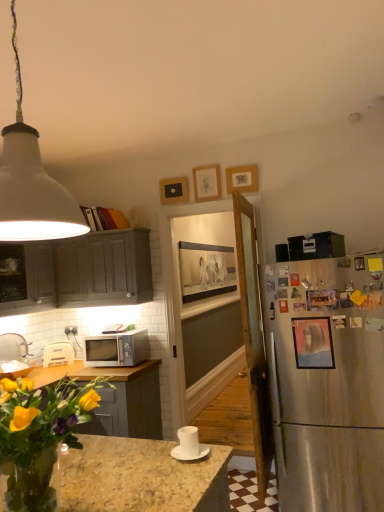
This screenshot has width=384, height=512. What do you see at coordinates (58, 354) in the screenshot?
I see `white plastic toaster at lower left` at bounding box center [58, 354].

This screenshot has width=384, height=512. What do you see at coordinates (322, 300) in the screenshot?
I see `wooden picture frame at right, acting as the 6th picture frame starting from the back` at bounding box center [322, 300].

The width and height of the screenshot is (384, 512). What do you see at coordinates (174, 190) in the screenshot?
I see `wooden picture frame at upper center, the 5th picture frame viewed from the front` at bounding box center [174, 190].

Image resolution: width=384 pixels, height=512 pixels. Find the location of `translucent glass vase at lower left`. translucent glass vase at lower left is located at coordinates (39, 436).

Consider the image. Between wooden picture frame at right, acting as the 6th picture frame starting from the back, and matte wooden picture frame at center, which is the sixth picture frame in front-to-back order, which one has smaller size?

With smaller size is wooden picture frame at right, acting as the 6th picture frame starting from the back.

Is wooden picture frame at right, marked as the first picture frame in a front-to-back arrangement, touching matte wooden picture frame at center, which is the sixth picture frame in front-to-back order?

No.

Can you confirm if wooden picture frame at right, acting as the 6th picture frame starting from the back, is taller than matte wooden picture frame at center, the first picture frame in the back-to-front sequence?

Incorrect, the height of wooden picture frame at right, acting as the 6th picture frame starting from the back, is not larger of that of matte wooden picture frame at center, the first picture frame in the back-to-front sequence.

From a real-world perspective, is wooden picture frame at right, acting as the 6th picture frame starting from the back, positioned above or below matte wooden picture frame at center, the first picture frame in the back-to-front sequence?

Clearly, from a real-world perspective, wooden picture frame at right, acting as the 6th picture frame starting from the back, is below matte wooden picture frame at center, the first picture frame in the back-to-front sequence.

Are wooden picture frame at upper center, the 2th picture frame positioned from the back, and white plastic toaster at lower left beside each other?

wooden picture frame at upper center, the 2th picture frame positioned from the back, is not next to white plastic toaster at lower left, and they're not touching.

Is wooden picture frame at upper center, the 5th picture frame viewed from the front, positioned behind white plastic toaster at lower left?

No, it is in front of white plastic toaster at lower left.

What's the angular difference between wooden picture frame at upper center, the 5th picture frame viewed from the front, and white plastic toaster at lower left's facing directions?

They differ by 33.4 degrees in their facing directions.

Considering the sizes of objects wooden picture frame at upper center, the 2th picture frame positioned from the back, and white plastic toaster at lower left in the image provided, who is taller, wooden picture frame at upper center, the 2th picture frame positioned from the back, or white plastic toaster at lower left?

With more height is wooden picture frame at upper center, the 2th picture frame positioned from the back.

Considering the positions of objects matte wooden picture frame at upper center, which ranks as the 4th picture frame in front-to-back order, and matte pink picture frame at right, arranged as the fifth picture frame when viewed from the back, in the image provided, who is in front, matte wooden picture frame at upper center, which ranks as the 4th picture frame in front-to-back order, or matte pink picture frame at right, arranged as the fifth picture frame when viewed from the back,?

matte pink picture frame at right, arranged as the fifth picture frame when viewed from the back, is more forward.

Considering the sizes of objects matte wooden picture frame at upper center, which ranks as the 4th picture frame in front-to-back order, and matte pink picture frame at right, arranged as the fifth picture frame when viewed from the back, in the image provided, who is smaller, matte wooden picture frame at upper center, which ranks as the 4th picture frame in front-to-back order, or matte pink picture frame at right, arranged as the fifth picture frame when viewed from the back,?

Smaller between the two is matte pink picture frame at right, arranged as the fifth picture frame when viewed from the back.

The height and width of the screenshot is (512, 384). There is a matte wooden picture frame at upper center, the 3th picture frame in the back-to-front sequence. What are the coordinates of `the 5th picture frame below it (from a real-world perspective)` in the screenshot? It's located at (313, 343).

Locate an element on the screen. This screenshot has width=384, height=512. the 1st picture frame counting from the right of the wooden picture frame at upper center, which is counted as the 3th picture frame, starting from the front is located at coordinates (313, 343).

Between matte pink picture frame at right, arranged as the fifth picture frame when viewed from the back, and wooden picture frame at upper center, arranged as the 4th picture frame when viewed from the back, which one is positioned in front?

Positioned in front is matte pink picture frame at right, arranged as the fifth picture frame when viewed from the back.

Is wooden picture frame at upper center, arranged as the 4th picture frame when viewed from the back, located within matte pink picture frame at right, arranged as the fifth picture frame when viewed from the back?

Definitely not — wooden picture frame at upper center, arranged as the 4th picture frame when viewed from the back, is not inside matte pink picture frame at right, arranged as the fifth picture frame when viewed from the back.

Which object is positioned more to the right, white matte pendant light at upper left or translucent glass vase at lower left?

translucent glass vase at lower left.

Is white matte pendant light at upper left positioned with its back to translucent glass vase at lower left?

white matte pendant light at upper left does not have its back to translucent glass vase at lower left.

Based on the photo, from a real-world perspective, which is physically above, white matte pendant light at upper left or translucent glass vase at lower left?

white matte pendant light at upper left is physically above.

From the image's perspective, is white matte pendant light at upper left below translucent glass vase at lower left?

No, from the image's perspective, white matte pendant light at upper left is not below translucent glass vase at lower left.

Does point (253, 189) come behind point (214, 173)?

No, it is in front of (214, 173).

Is wooden picture frame at upper center, arranged as the 4th picture frame when viewed from the back, in front of or behind matte wooden picture frame at upper center, the 3th picture frame in the back-to-front sequence, in the image?

Visually, wooden picture frame at upper center, arranged as the 4th picture frame when viewed from the back, is located in front of matte wooden picture frame at upper center, the 3th picture frame in the back-to-front sequence.

From the wooden picture frame at upper center, which is counted as the 3th picture frame, starting from the front, count 1st picture frames backward and point to it. Please provide its 2D coordinates.

[(207, 183)]

Is wooden picture frame at upper center, which is counted as the 3th picture frame, starting from the front, completely or partially outside of matte wooden picture frame at upper center, which ranks as the 4th picture frame in front-to-back order?

wooden picture frame at upper center, which is counted as the 3th picture frame, starting from the front, lies outside matte wooden picture frame at upper center, which ranks as the 4th picture frame in front-to-back order,'s area.

This screenshot has height=512, width=384. I want to click on the 2nd picture frame located beneath the white matte pendant light at upper left (from a real-world perspective), so click(x=322, y=300).

From the image's perspective, is white matte pendant light at upper left on top of wooden picture frame at right, marked as the first picture frame in a front-to-back arrangement?

Indeed, from the image's perspective, white matte pendant light at upper left is shown above wooden picture frame at right, marked as the first picture frame in a front-to-back arrangement.

Is white matte pendant light at upper left facing away from wooden picture frame at right, acting as the 6th picture frame starting from the back?

No.

Locate an element on the screen. The width and height of the screenshot is (384, 512). picture frame that is the 3rd object to the left of the wooden picture frame at right, acting as the 6th picture frame starting from the back, starting at the anchor is located at coordinates (206, 270).

Locate an element on the screen. This screenshot has width=384, height=512. picture frame that is the 4th one when counting upward from the white plastic toaster at lower left (from the image's perspective) is located at coordinates (174, 190).

When comparing their distances from wooden picture frame at upper center, the 5th picture frame viewed from the front, does matte gray cabinet at left, the first cabinetry from the left, or wooden picture frame at right, acting as the 6th picture frame starting from the back, seem closer?

matte gray cabinet at left, the first cabinetry from the left, is closer to wooden picture frame at upper center, the 5th picture frame viewed from the front.

When comparing their distances from wooden picture frame at upper center, the 5th picture frame viewed from the front, does matte pink picture frame at right, marked as the 2th picture frame in a front-to-back arrangement, or matte gray cabinet at left, which appears as the second cabinetry when viewed from the right, seem closer?

matte gray cabinet at left, which appears as the second cabinetry when viewed from the right, is closer to wooden picture frame at upper center, the 5th picture frame viewed from the front.

Which object lies nearer to the anchor point matte pink picture frame at right, marked as the 2th picture frame in a front-to-back arrangement, white matte saucer at lower center or matte wooden picture frame at center, which is the sixth picture frame in front-to-back order?

Based on the image, white matte saucer at lower center appears to be nearer to matte pink picture frame at right, marked as the 2th picture frame in a front-to-back arrangement.

Considering their positions, is wooden picture frame at upper center, the 2th picture frame positioned from the back, positioned closer to white matte saucer at lower center than matte pink picture frame at right, arranged as the fifth picture frame when viewed from the back?

matte pink picture frame at right, arranged as the fifth picture frame when viewed from the back, is closer to white matte saucer at lower center.

When comparing their distances from matte gray cabinet at left, which appears as the second cabinetry when viewed from the right, does wooden picture frame at right, acting as the 6th picture frame starting from the back, or satin silver microwave at lower left seem further?

wooden picture frame at right, acting as the 6th picture frame starting from the back.

When comparing their distances from matte gray cabinet at left, the first cabinetry from the left, does satin silver microwave at lower left or white matte pendant light at upper left seem closer?

The object closer to matte gray cabinet at left, the first cabinetry from the left, is satin silver microwave at lower left.

From the image, which object appears to be farther from matte gray cabinet at left, which appears as the second cabinetry when viewed from the right, matte wooden picture frame at upper center, which ranks as the 4th picture frame in front-to-back order, or white matte pendant light at upper left?

Based on the image, white matte pendant light at upper left appears to be further to matte gray cabinet at left, which appears as the second cabinetry when viewed from the right.

Based on the photo, based on their spatial positions, is wooden picture frame at upper center, the 5th picture frame viewed from the front, or satin silver microwave at lower left closer to white plastic toaster at lower left?

satin silver microwave at lower left is positioned closer to the anchor white plastic toaster at lower left.

Identify the location of microwave oven between white matte saucer at lower center and matte wooden picture frame at center, the first picture frame in the back-to-front sequence, in the front-back direction. This screenshot has height=512, width=384. (117, 349).

At what (x,y) coordinates should I click in order to perform the action: click on lamp between translucent glass vase at lower left and matte pink picture frame at right, arranged as the fifth picture frame when viewed from the back, in the front-back direction. Please return your answer as a coordinate pair (x, y). This screenshot has width=384, height=512. Looking at the image, I should click on (31, 183).

Locate an element on the screen. cabinetry between translucent glass vase at lower left and matte gray cabinet at upper left, which is the first cabinetry from right to left, from front to back is located at coordinates (26, 278).

You are a GUI agent. You are given a task and a screenshot of the screen. Output one action in this format:
    pyautogui.click(x=<x>, y=<y>)
    Task: Click on the microwave oven between matte gray cabinet at left, the first cabinetry from the left, and wooden picture frame at upper center, arranged as the 4th picture frame when viewed from the back, in the horizontal direction
    The image size is (384, 512).
    Given the screenshot: What is the action you would take?
    pyautogui.click(x=117, y=349)